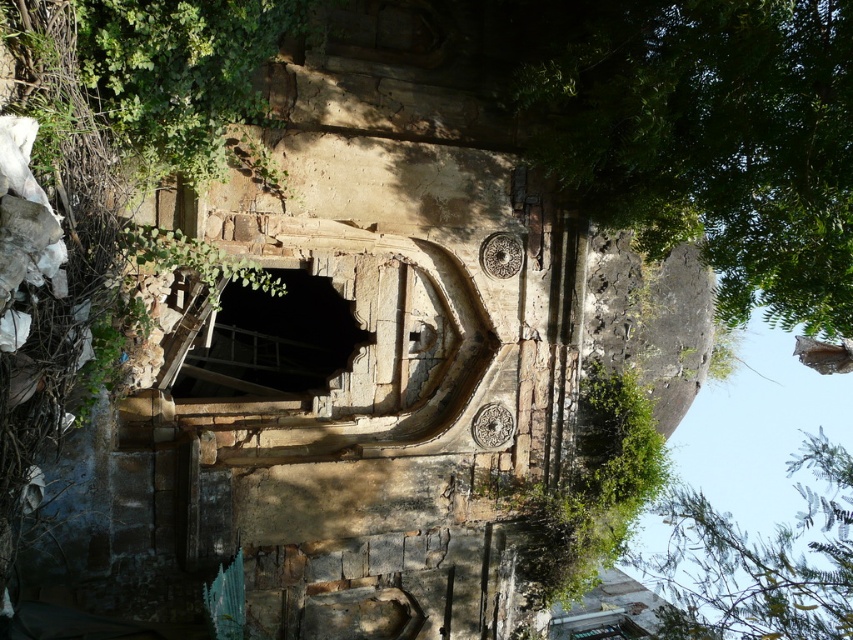
Between green leafy tree at upper right and dark stone hole at center, which one is positioned lower?

dark stone hole at center

Does green leafy tree at upper right lie behind dark stone hole at center?

No.

Is point (763, 88) positioned after point (206, 385)?

No, it is in front of (206, 385).

At what (x,y) coordinates should I click in order to perform the action: click on green leafy tree at upper right. Please return your answer as a coordinate pair (x, y). This screenshot has height=640, width=853. Looking at the image, I should click on (712, 140).

Is green leafy tree at upper right positioned behind green leafy tree at lower right?

That is False.

Describe the element at coordinates (712, 140) in the screenshot. The width and height of the screenshot is (853, 640). I see `green leafy tree at upper right` at that location.

Find the location of a particular element. The image size is (853, 640). green leafy tree at upper right is located at coordinates (712, 140).

This screenshot has width=853, height=640. Describe the element at coordinates (759, 561) in the screenshot. I see `green leafy tree at lower right` at that location.

Based on the photo, between green leafy tree at lower right and dark stone hole at center, which one has less height?

dark stone hole at center is shorter.

Which is behind, point (788, 570) or point (310, 342)?

Positioned behind is point (310, 342).

I want to click on green leafy tree at lower right, so click(x=759, y=561).